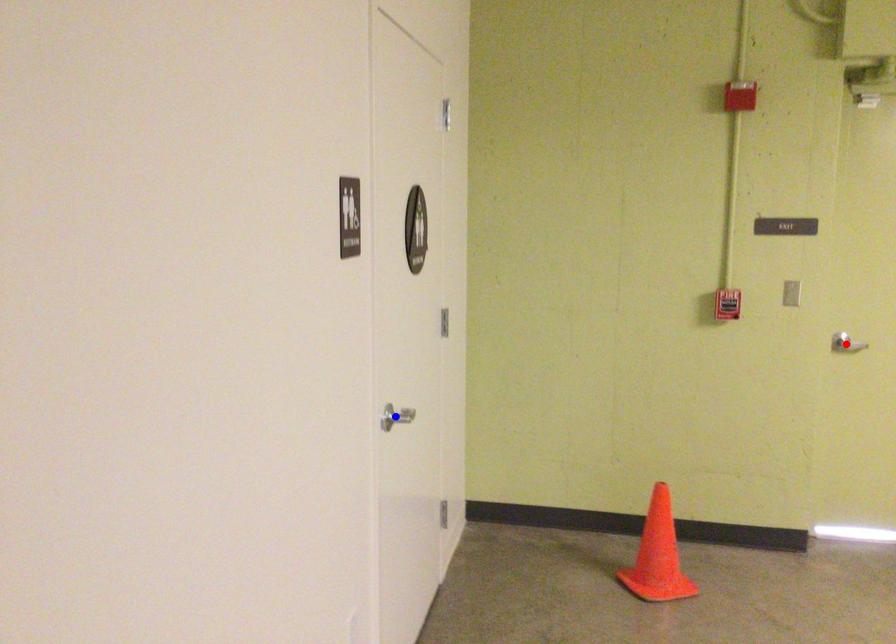
Question: Which of the two points in the image is closer to the camera?

Choices:
 (A) Blue point is closer.
 (B) Red point is closer.

Answer: (A)